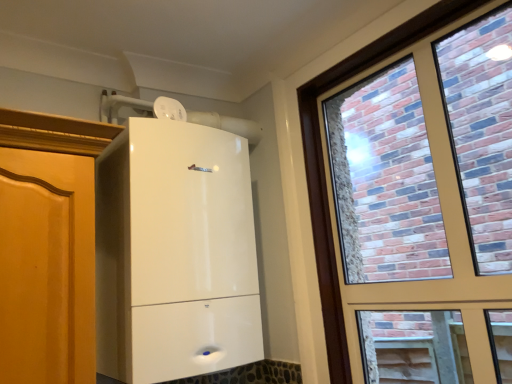
Question: Relative to white glossy boiler at center, is brick-patterned glass window at right in front or behind?

Choices:
 (A) front
 (B) behind

Answer: (A)

Question: Is brick-patterned glass window at right inside the boundaries of white glossy boiler at center, or outside?

Choices:
 (A) outside
 (B) inside

Answer: (A)

Question: From their relative heights in the image, would you say brick-patterned glass window at right is taller or shorter than white glossy boiler at center?

Choices:
 (A) short
 (B) tall

Answer: (B)

Question: Is point (105, 178) closer or farther from the camera than point (314, 249)?

Choices:
 (A) farther
 (B) closer

Answer: (B)

Question: Based on their positions, is white glossy boiler at center located to the left or right of brick-patterned glass window at right?

Choices:
 (A) left
 (B) right

Answer: (A)

Question: Choose the correct answer: Is white glossy boiler at center inside brick-patterned glass window at right or outside it?

Choices:
 (A) outside
 (B) inside

Answer: (A)

Question: Looking at their shapes, would you say white glossy boiler at center is wider or thinner than brick-patterned glass window at right?

Choices:
 (A) wide
 (B) thin

Answer: (A)